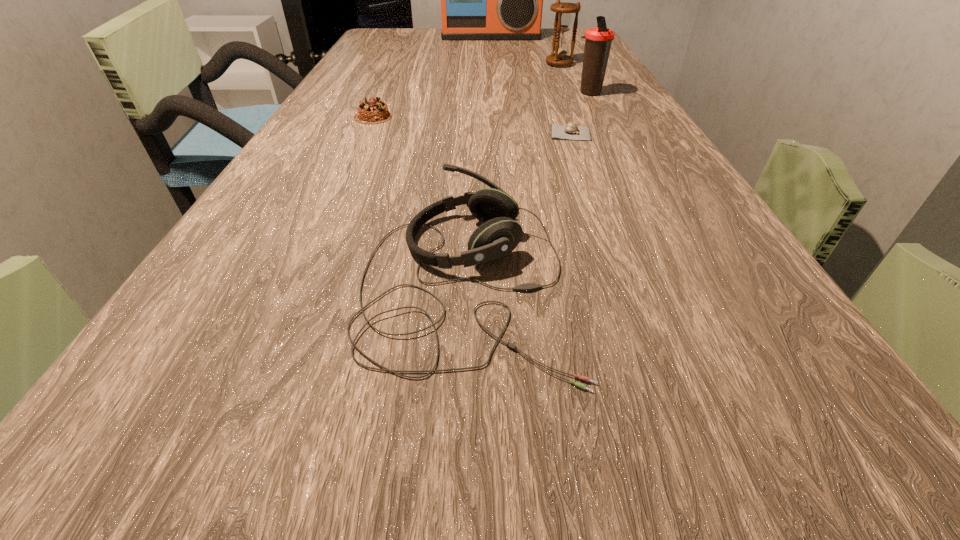
The width and height of the screenshot is (960, 540). I want to click on vacant space situated on the front-facing side of the tallest object, so click(492, 58).

Locate an element on the screen. This screenshot has height=540, width=960. vacant space located on the back of the thermos bottle is located at coordinates (576, 67).

At what (x,y) coordinates should I click in order to perform the action: click on vacant space located 0.220m on the front of the fifth nearest object. Please return your answer as a coordinate pair (x, y). Image resolution: width=960 pixels, height=540 pixels. Looking at the image, I should click on (573, 97).

Image resolution: width=960 pixels, height=540 pixels. I want to click on free point located 0.140m on the outer surface of the fourth tallest object, so click(x=680, y=282).

Locate an element on the screen. blank space located on the left of the leftmost object is located at coordinates (319, 117).

This screenshot has height=540, width=960. I want to click on free spot located 0.240m on the left of the second nearest object, so click(x=435, y=133).

Locate an element on the screen. Image resolution: width=960 pixels, height=540 pixels. object located in the far edge section of the desktop is located at coordinates (480, 0).

At what (x,y) coordinates should I click in order to perform the action: click on object that is at the left edge. Please return your answer as a coordinate pair (x, y). This screenshot has width=960, height=540. Looking at the image, I should click on (375, 111).

Where is `radio receiver that is at the right edge`? This screenshot has width=960, height=540. radio receiver that is at the right edge is located at coordinates (480, 0).

The width and height of the screenshot is (960, 540). What are the coordinates of `thermos bottle that is at the right edge` in the screenshot? It's located at (598, 41).